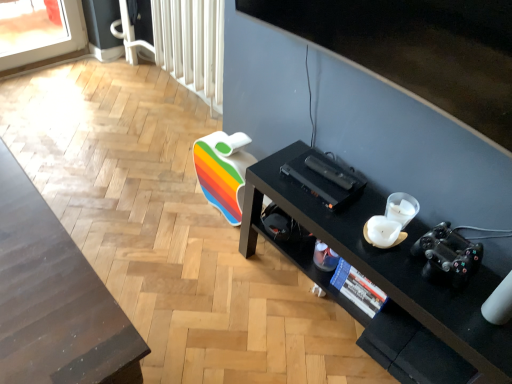
Question: Is the depth of shiny dark wood table at lower left greater than that of black matte desk at lower right?

Choices:
 (A) no
 (B) yes

Answer: (A)

Question: Does shiny dark wood table at lower left have a larger size compared to black matte desk at lower right?

Choices:
 (A) yes
 (B) no

Answer: (A)

Question: Is shiny dark wood table at lower left facing away from black matte desk at lower right?

Choices:
 (A) no
 (B) yes

Answer: (A)

Question: Can you confirm if shiny dark wood table at lower left is taller than black matte desk at lower right?

Choices:
 (A) yes
 (B) no

Answer: (A)

Question: Can you confirm if shiny dark wood table at lower left is wider than black matte desk at lower right?

Choices:
 (A) yes
 (B) no

Answer: (A)

Question: From the image's perspective, would you say shiny dark wood table at lower left is positioned over black matte desk at lower right?

Choices:
 (A) no
 (B) yes

Answer: (A)

Question: From a real-world perspective, does white plastic radiator at upper center sit lower than shiny dark wood table at lower left?

Choices:
 (A) no
 (B) yes

Answer: (A)

Question: Can you confirm if white plastic radiator at upper center is taller than shiny dark wood table at lower left?

Choices:
 (A) yes
 (B) no

Answer: (A)

Question: Considering the relative sizes of white plastic radiator at upper center and shiny dark wood table at lower left in the image provided, is white plastic radiator at upper center smaller than shiny dark wood table at lower left?

Choices:
 (A) no
 (B) yes

Answer: (B)

Question: From the image's perspective, is white plastic radiator at upper center beneath shiny dark wood table at lower left?

Choices:
 (A) no
 (B) yes

Answer: (A)

Question: Can you confirm if white plastic radiator at upper center is positioned to the right of shiny dark wood table at lower left?

Choices:
 (A) yes
 (B) no

Answer: (A)

Question: Is white plastic radiator at upper center not near shiny dark wood table at lower left?

Choices:
 (A) yes
 (B) no

Answer: (A)

Question: Can we say black matte desk at lower right lies outside white plastic radiator at upper center?

Choices:
 (A) no
 (B) yes

Answer: (B)